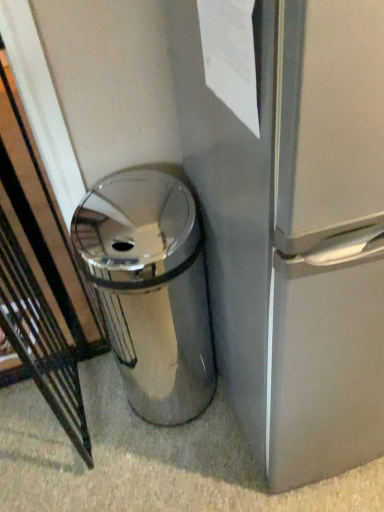
Question: Is polished silver trash can at center beside white paper at upper center?

Choices:
 (A) yes
 (B) no

Answer: (B)

Question: Is polished silver trash can at center looking in the opposite direction of white paper at upper center?

Choices:
 (A) yes
 (B) no

Answer: (B)

Question: Is white paper at upper center inside polished silver trash can at center?

Choices:
 (A) no
 (B) yes

Answer: (A)

Question: From the image's perspective, is polished silver trash can at center below white paper at upper center?

Choices:
 (A) no
 (B) yes

Answer: (B)

Question: Considering the relative sizes of polished silver trash can at center and white paper at upper center in the image provided, is polished silver trash can at center wider than white paper at upper center?

Choices:
 (A) yes
 (B) no

Answer: (A)

Question: From a real-world perspective, is polished silver trash can at center positioned over white paper at upper center based on gravity?

Choices:
 (A) no
 (B) yes

Answer: (A)

Question: From the image's perspective, does white paper at upper center appear lower than polished silver trash can at center?

Choices:
 (A) yes
 (B) no

Answer: (B)

Question: Is white paper at upper center not inside polished silver trash can at center?

Choices:
 (A) yes
 (B) no

Answer: (A)

Question: Could you tell me if white paper at upper center is facing polished silver trash can at center?

Choices:
 (A) yes
 (B) no

Answer: (B)

Question: Is white paper at upper center shorter than polished silver trash can at center?

Choices:
 (A) no
 (B) yes

Answer: (B)

Question: Is white paper at upper center taller than polished silver trash can at center?

Choices:
 (A) no
 (B) yes

Answer: (A)

Question: Does white paper at upper center appear on the left side of polished silver trash can at center?

Choices:
 (A) no
 (B) yes

Answer: (A)

Question: Considering the positions of point (244, 101) and point (188, 369), is point (244, 101) closer or farther from the camera than point (188, 369)?

Choices:
 (A) farther
 (B) closer

Answer: (B)